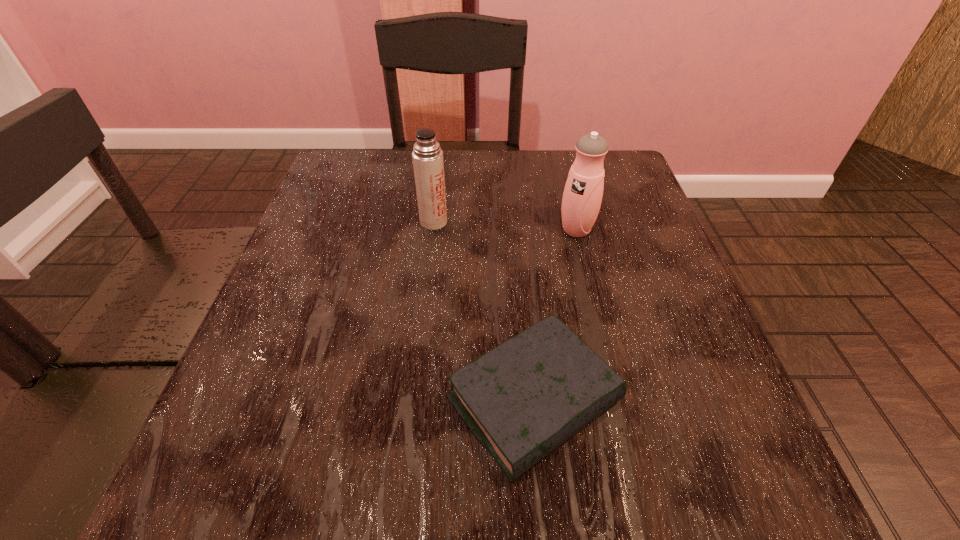
Where is `the right thermos bottle`? Image resolution: width=960 pixels, height=540 pixels. the right thermos bottle is located at coordinates (582, 196).

Where is `the left thermos bottle`? This screenshot has width=960, height=540. the left thermos bottle is located at coordinates (427, 157).

Where is `Bible`? The height and width of the screenshot is (540, 960). Bible is located at coordinates (521, 400).

Where is `the nearest object`? Image resolution: width=960 pixels, height=540 pixels. the nearest object is located at coordinates (521, 400).

At what (x,y) coordinates should I click in order to perform the action: click on free space located 0.350m on the left of the right thermos bottle. Please return your answer as a coordinate pair (x, y). Looking at the image, I should click on (390, 230).

I want to click on vacant space situated 0.150m on the front of the leftmost object, so click(426, 282).

The width and height of the screenshot is (960, 540). I want to click on free point located 0.150m on the right of the nearest object, so click(x=723, y=401).

You are a GUI agent. You are given a task and a screenshot of the screen. Output one action in this format:
    pyautogui.click(x=<x>, y=<y>)
    Task: Click on the object that is at the near edge
    
    Given the screenshot: What is the action you would take?
    pyautogui.click(x=521, y=400)

The width and height of the screenshot is (960, 540). I want to click on object that is at the right edge, so click(582, 196).

This screenshot has width=960, height=540. In order to click on vacant space at the far edge in this screenshot , I will do `click(458, 169)`.